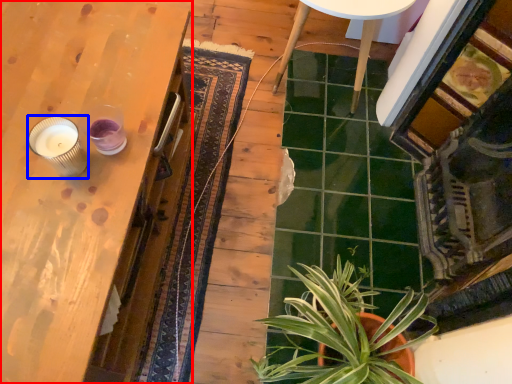
Question: Which object is further to the camera taking this photo, table (highlighted by a red box) or candle holder (highlighted by a blue box)?

Choices:
 (A) table
 (B) candle holder

Answer: (B)